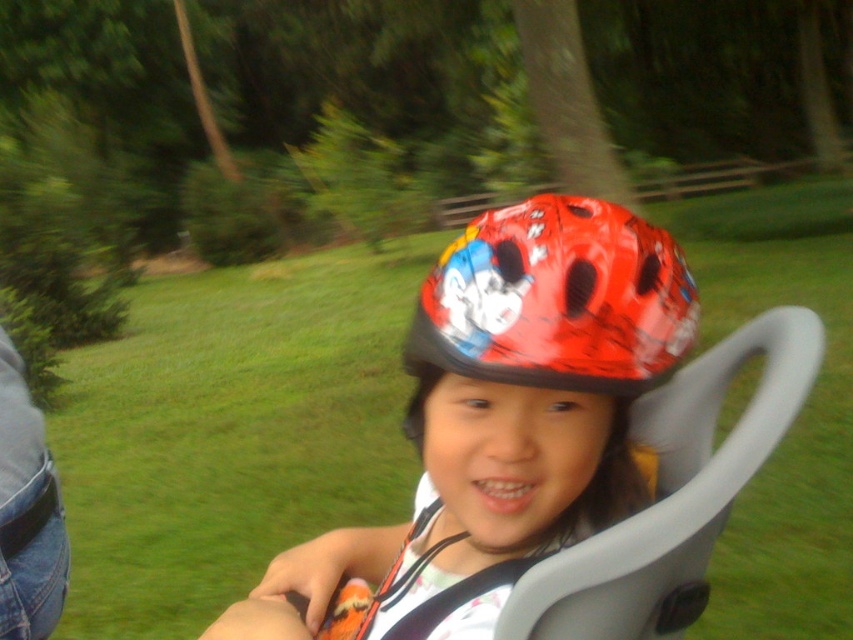
Question: Among these points, which one is farthest from the camera?

Choices:
 (A) (473, 424)
 (B) (561, 292)

Answer: (A)

Question: Where is glossy plastic helmet at center located in relation to shiny red helmet at center in the image?

Choices:
 (A) above
 (B) below

Answer: (B)

Question: From the image, what is the correct spatial relationship of glossy plastic helmet at center in relation to shiny red helmet at center?

Choices:
 (A) left
 (B) right

Answer: (A)

Question: Which point is closer to the camera?

Choices:
 (A) [454, 275]
 (B) [595, 269]

Answer: (B)

Question: Is glossy plastic helmet at center above shiny red helmet at center?

Choices:
 (A) no
 (B) yes

Answer: (A)